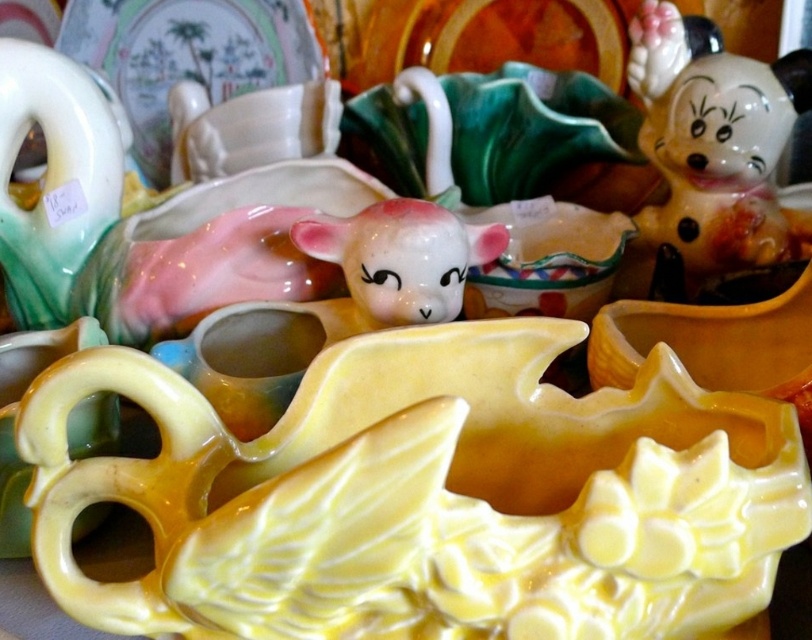
You are standing in front of a display of ceramic items. You notice two points marked on the image. The first point is labeled as point (763,88) and the second is point (454,241). Based on their positions, which point is closer to you?

Point (454,241) is closer to you because the point (763,88) is behind it.

You are an interior designer arranging a shelf. You have the white glossy minnie mouse figurine at upper right and the matte porcelain lamb at center. Which figurine is wider?

The white glossy minnie mouse figurine at upper right is wider than the matte porcelain lamb at center.